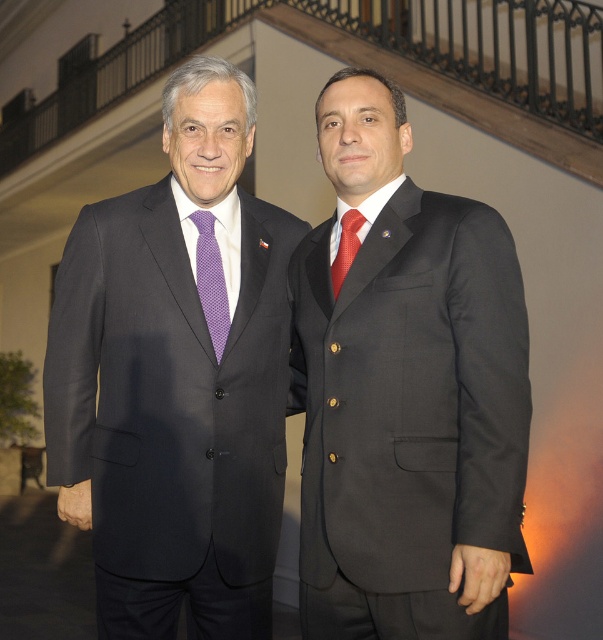
From the picture: Can you confirm if matte black suit at right is positioned below matte black suit at center?

Correct, matte black suit at right is located below matte black suit at center.

Is matte black suit at right shorter than matte black suit at center?

Indeed, matte black suit at right has a lesser height compared to matte black suit at center.

Consider the image. Who is more forward, (x=343, y=125) or (x=127, y=336)?

Point (x=343, y=125) is more forward.

This screenshot has width=603, height=640. What are the coordinates of `matte black suit at right` in the screenshot? It's located at click(405, 392).

Who is positioned more to the right, matte black suit at right or purple dotted tie at left?

matte black suit at right

Describe the element at coordinates (405, 392) in the screenshot. I see `matte black suit at right` at that location.

Find the location of a particular element. Image resolution: width=603 pixels, height=640 pixels. matte black suit at right is located at coordinates (405, 392).

Between point (206, 305) and point (339, 253), which one is positioned in front?

Point (339, 253) is more forward.

Can you confirm if purple dotted tie at left is taller than red silk tie at center?

Indeed, purple dotted tie at left has a greater height compared to red silk tie at center.

Between point (200, 225) and point (336, 257), which one is positioned in front?

Point (336, 257) is in front.

Identify the location of purple dotted tie at left. (210, 280).